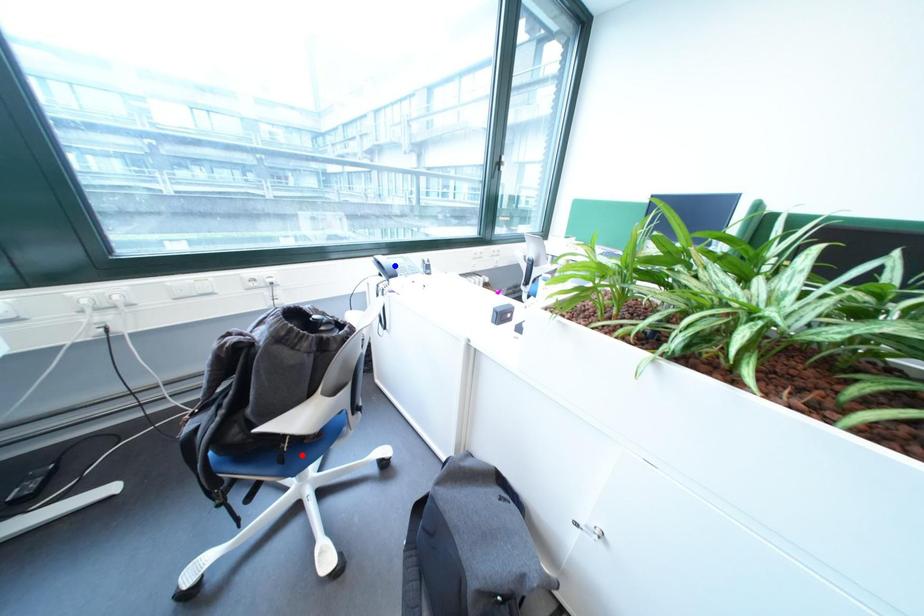
Question: Two points are marked on the image. Which point is closer to the camera?

Choices:
 (A) Blue point is closer.
 (B) Red point is closer.

Answer: (B)